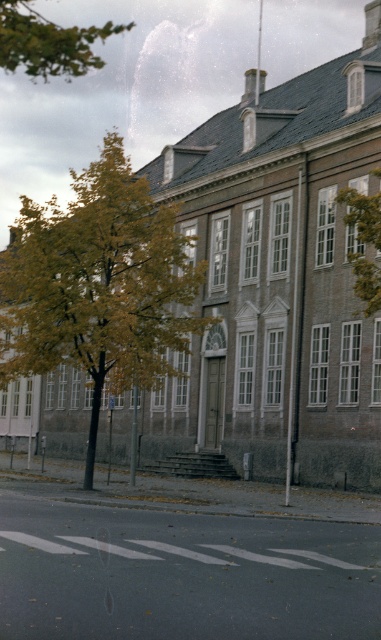
Question: Does yellow-green leaves at center have a larger size compared to green leafy tree at upper right?

Choices:
 (A) yes
 (B) no

Answer: (A)

Question: Is green leafy tree at upper left above green leafy tree at upper right?

Choices:
 (A) yes
 (B) no

Answer: (A)

Question: Which of the following is the closest to the observer?

Choices:
 (A) white plastic sign at center
 (B) green leafy tree at upper right

Answer: (B)

Question: Which of these objects is positioned closest to the green leafy tree at upper right?

Choices:
 (A) yellow-green leaves at center
 (B) green leafy tree at upper left

Answer: (A)

Question: Does green leafy tree at upper left appear on the right side of white plastic sign at center?

Choices:
 (A) no
 (B) yes

Answer: (A)

Question: Among these objects, which one is farthest from the camera?

Choices:
 (A) yellow-green leaves at center
 (B) green leafy tree at upper right
 (C) green leafy tree at upper left
 (D) white plastic sign at center

Answer: (D)